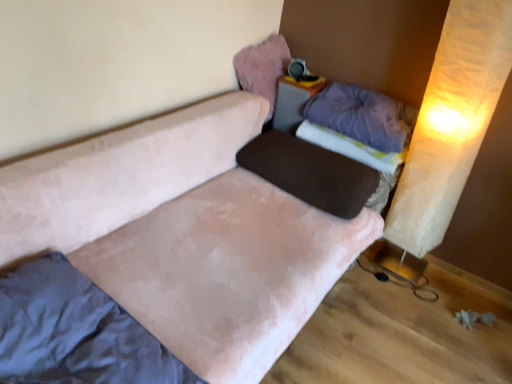
Question: From a real-world perspective, is beige paper curtain at right positioned above or below matte plastic table at upper center?

Choices:
 (A) above
 (B) below

Answer: (A)

Question: Is beige paper curtain at right taller or shorter than matte plastic table at upper center?

Choices:
 (A) tall
 (B) short

Answer: (A)

Question: Estimate the real-world distances between objects in this image. Which object is closer to the velvet pink couch at center?

Choices:
 (A) purple fabric mattress at upper right, which is the second mattress in bottom-to-top order
 (B) brown fabric pillow at center, the 3th pillow viewed from the top
 (C) matte plastic table at upper center
 (D) velvet pink pillow at upper center, the 1th pillow in the top-to-bottom sequence
 (E) beige paper curtain at right

Answer: (B)

Question: Which is nearer to the suede-like beige mattress at lower left, which is the 1th mattress from front to back?

Choices:
 (A) velvet pink couch at center
 (B) velvet pink pillow at upper center, the 1th pillow in the top-to-bottom sequence
 (C) beige paper curtain at right
 (D) purple fabric mattress at upper right, which is the second mattress in bottom-to-top order
 (E) brown fabric pillow at center, the 3th pillow viewed from the top

Answer: (A)